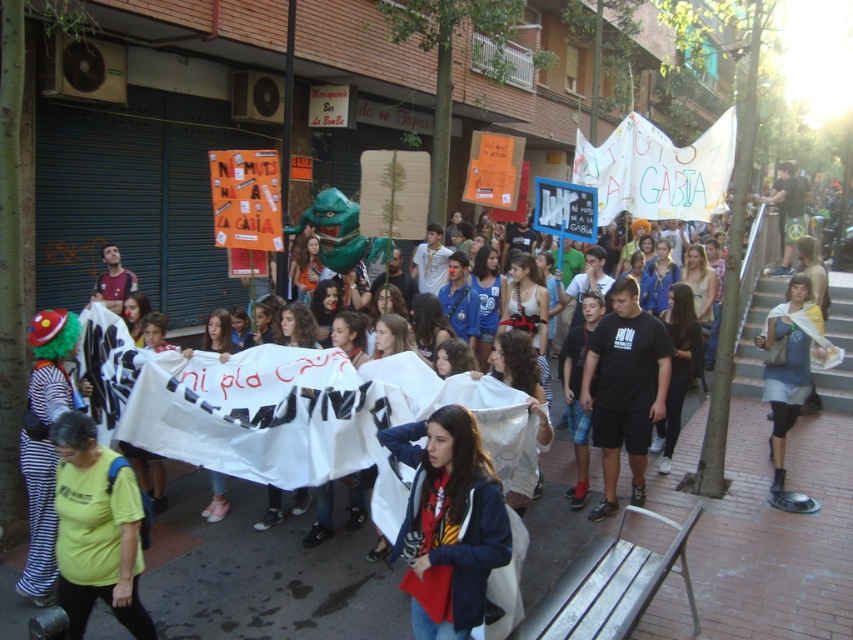
Question: Which of the following is the closest to the observer?

Choices:
 (A) denim skirt at center
 (B) black cotton t-shirt at center
 (C) dark blue jacket at center
 (D) white fabric banner at center

Answer: (C)

Question: Estimate the real-world distances between objects in this image. Which object is farther from the denim skirt at center?

Choices:
 (A) black cotton t-shirt at center
 (B) white fabric banner at center

Answer: (A)

Question: Estimate the real-world distances between objects in this image. Which object is closer to the denim skirt at center?

Choices:
 (A) white fabric banner at center
 (B) black cotton t-shirt at center
 (C) dark blue jacket at center

Answer: (A)

Question: Is dark blue jacket at center to the right of denim skirt at center from the viewer's perspective?

Choices:
 (A) no
 (B) yes

Answer: (A)

Question: Does white fabric banner at center appear over dark blue jacket at center?

Choices:
 (A) no
 (B) yes

Answer: (A)

Question: In this image, where is white fabric banner at center located relative to dark blue jacket at center?

Choices:
 (A) below
 (B) above

Answer: (A)